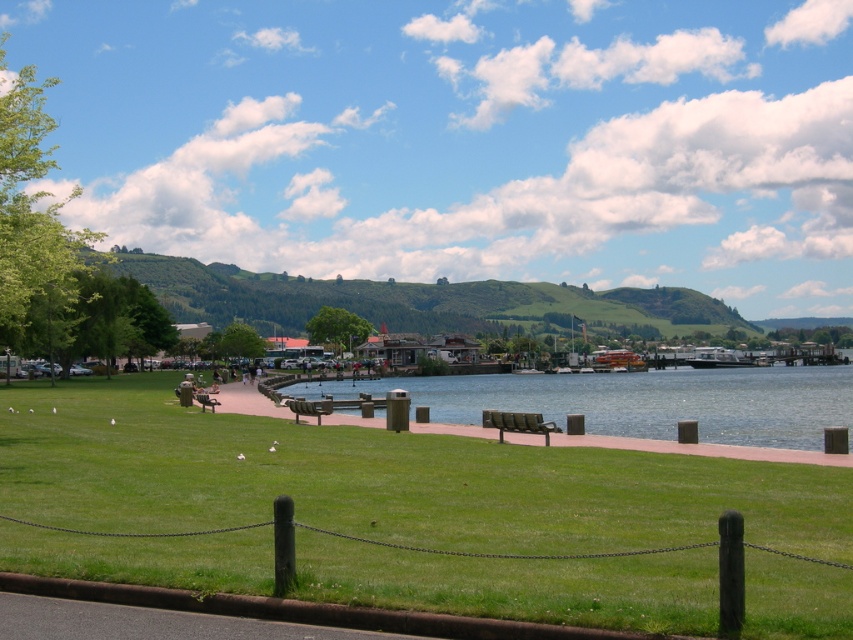
Based on the photo, between metallic green bench at center and green wooden bench at center, which one has less height?

Standing shorter between the two is green wooden bench at center.

Does point (534, 417) lie in front of point (202, 396)?

Yes, point (534, 417) is closer to viewer.

At what (x,y) coordinates should I click in order to perform the action: click on metallic green bench at center. Please return your answer as a coordinate pair (x, y). Image resolution: width=853 pixels, height=640 pixels. Looking at the image, I should click on (518, 422).

The width and height of the screenshot is (853, 640). I want to click on green grass at lower center, so click(x=383, y=480).

Which is in front, point (767, 595) or point (271, 400)?

Point (767, 595) is in front.

Does point (323, 499) come behind point (271, 394)?

No, (323, 499) is closer to viewer.

At what (x,y) coordinates should I click in order to perform the action: click on green grass at lower center. Please return your answer as a coordinate pair (x, y). Looking at the image, I should click on (383, 480).

Does metallic park bench at center appear over green wooden bench at center?

Indeed, metallic park bench at center is positioned over green wooden bench at center.

Who is positioned more to the left, metallic park bench at center or green wooden bench at center?

green wooden bench at center

Which is in front, point (297, 413) or point (206, 401)?

Point (297, 413) is in front.

At what (x,y) coordinates should I click in order to perform the action: click on metallic park bench at center. Please return your answer as a coordinate pair (x, y). Looking at the image, I should click on (309, 406).